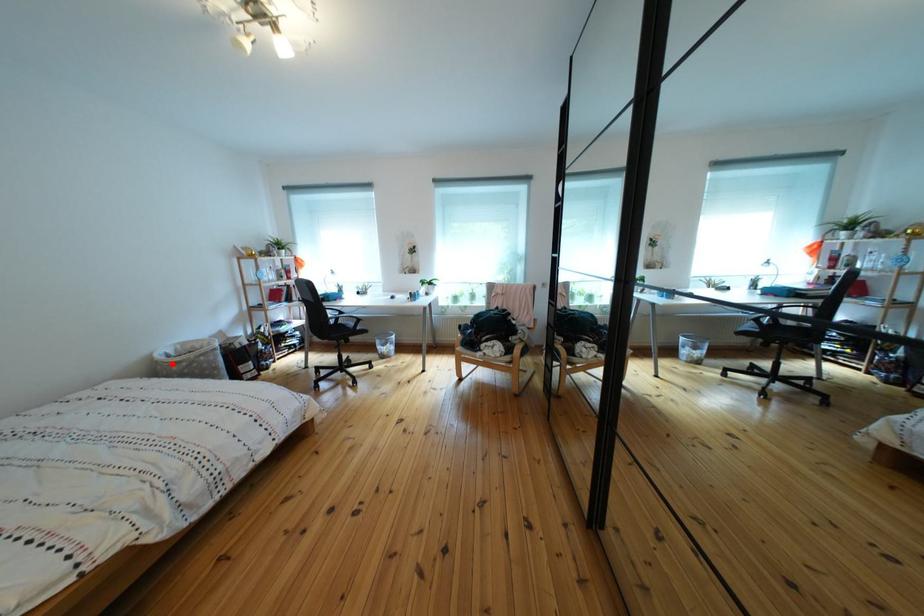
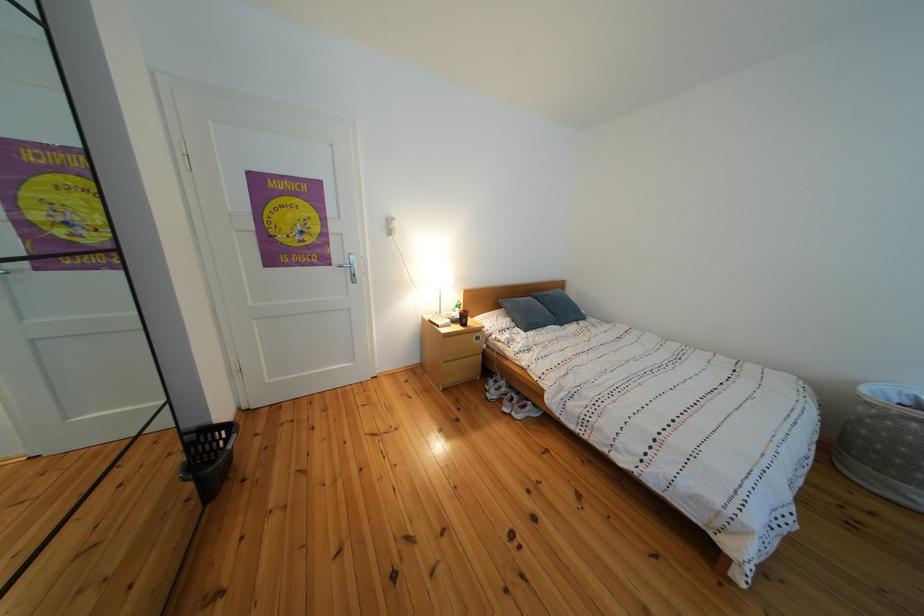
The point at the highlighted location is marked in the first image. Where is the corresponding point in the second image?

(890, 398)